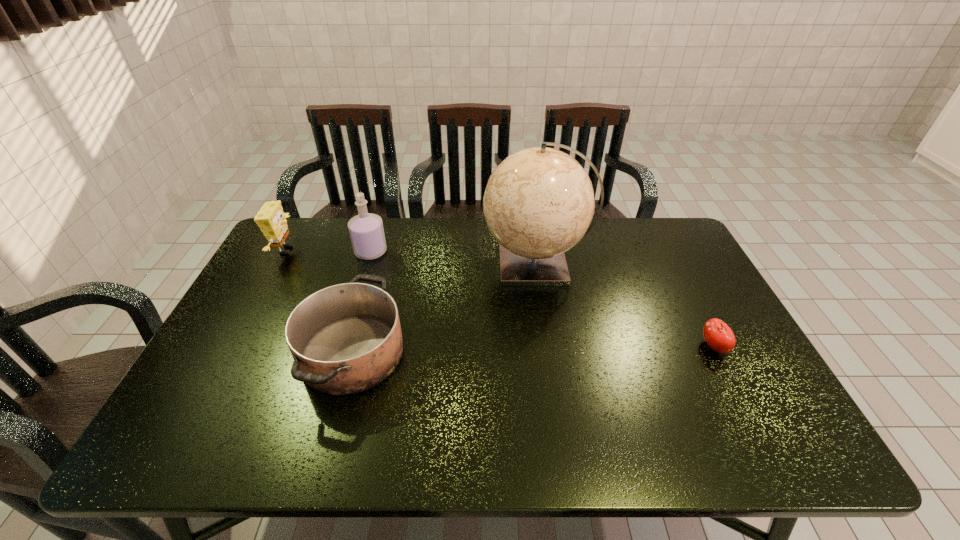
Locate an element on the screen. The width and height of the screenshot is (960, 540). free point between the second shortest object and the globe is located at coordinates (444, 309).

The height and width of the screenshot is (540, 960). Find the location of `vacant space that's between the globe and the leftmost object`. vacant space that's between the globe and the leftmost object is located at coordinates (411, 257).

Find the location of a particular element. object that is the fourth closest to the fourth object from left to right is located at coordinates (271, 219).

Find the location of a particular element. This screenshot has width=960, height=540. the second closest object to the tallest object is located at coordinates (717, 334).

You are a GUI agent. You are given a task and a screenshot of the screen. Output one action in this format:
    pyautogui.click(x=<x>, y=<y>)
    Task: Click on the vacant space that satisfies the following two spatial constraints: 1. on the surface of the fourth object from left to right showing Europe and Africa; 2. on the back side of the rightmost object
    This screenshot has width=960, height=540.
    Given the screenshot: What is the action you would take?
    pyautogui.click(x=549, y=347)

Locate an element on the screen. The width and height of the screenshot is (960, 540). vacant space that satisfies the following two spatial constraints: 1. on the back side of the shortest object; 2. on the surface of the tallest object showing Europe and Africa is located at coordinates (671, 264).

Find the location of a particular element. vacant position in the image that satisfies the following two spatial constraints: 1. on the face of the sponge; 2. on the right side of the second tallest object is located at coordinates (284, 252).

Identify the location of free space that satisfies the following two spatial constraints: 1. on the face of the sponge; 2. on the left side of the rightmost object. The width and height of the screenshot is (960, 540). (232, 347).

Find the location of a particular element. Image resolution: width=960 pixels, height=540 pixels. vacant space that satisfies the following two spatial constraints: 1. on the face of the third shortest object; 2. on the left side of the second shortest object is located at coordinates point(229,353).